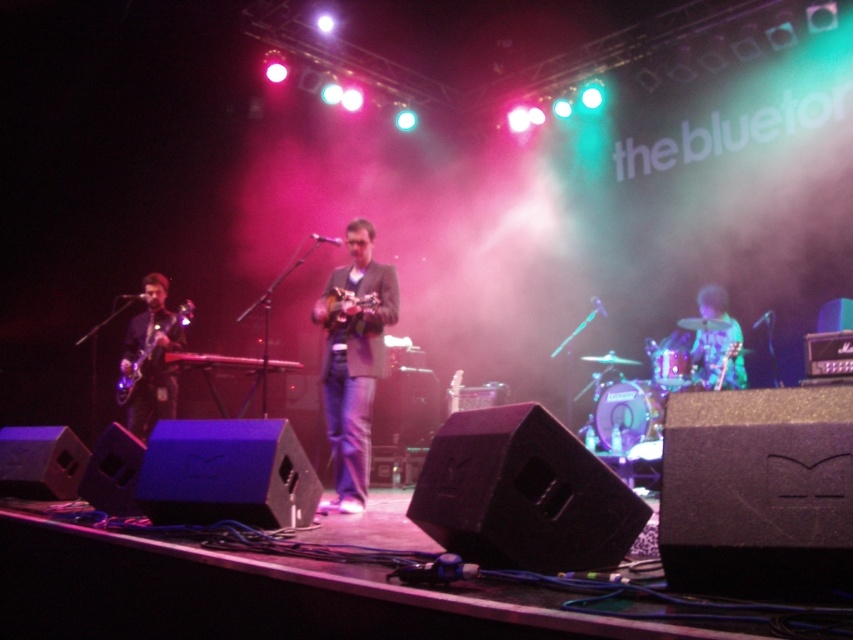
Can you confirm if matte gray suit at center is wider than metallic silver keyboard at center?

No.

Consider the image. Is matte gray suit at center to the left of metallic silver keyboard at center from the viewer's perspective?

In fact, matte gray suit at center is to the right of metallic silver keyboard at center.

The width and height of the screenshot is (853, 640). I want to click on matte gray suit at center, so click(354, 362).

Which of these two, metallic silver keyboard at center or matte brown guitar at center, stands taller?

Standing taller between the two is matte brown guitar at center.

Between point (257, 356) and point (338, 305), which one is positioned in front?

Point (338, 305)

The image size is (853, 640). Find the location of `metallic silver keyboard at center`. metallic silver keyboard at center is located at coordinates (230, 362).

Does matte black guitar at left have a larger size compared to matte brown guitar at center?

Correct, matte black guitar at left is larger in size than matte brown guitar at center.

How much distance is there between matte black guitar at left and matte brown guitar at center?

5.93 feet

Is point (136, 342) positioned before point (345, 308)?

No, it is behind (345, 308).

Find the location of a particular element. matte black guitar at left is located at coordinates (151, 358).